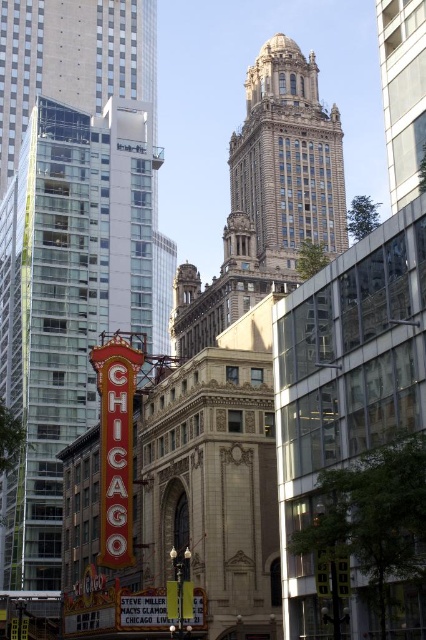
You are a photographer standing in the middle of the square. You want to take a photo of the brown stone tower at upper center without any obstructions. Is the red glass building at left blocking your view of it?

The red glass building at left is in front of the brown stone tower at upper center, so it is blocking the view of the brown stone tower at upper center. You will need to move to a different position to capture an unobstructed view.